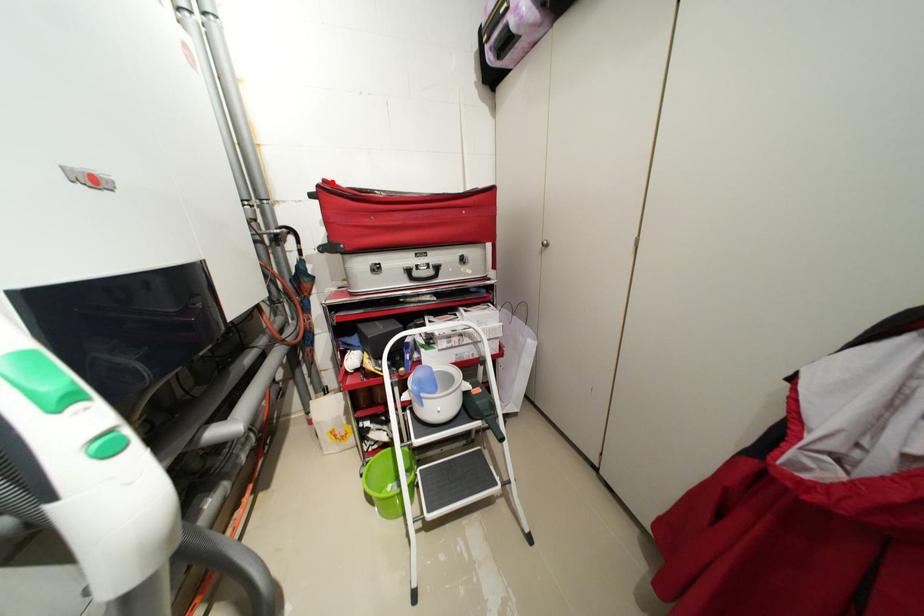
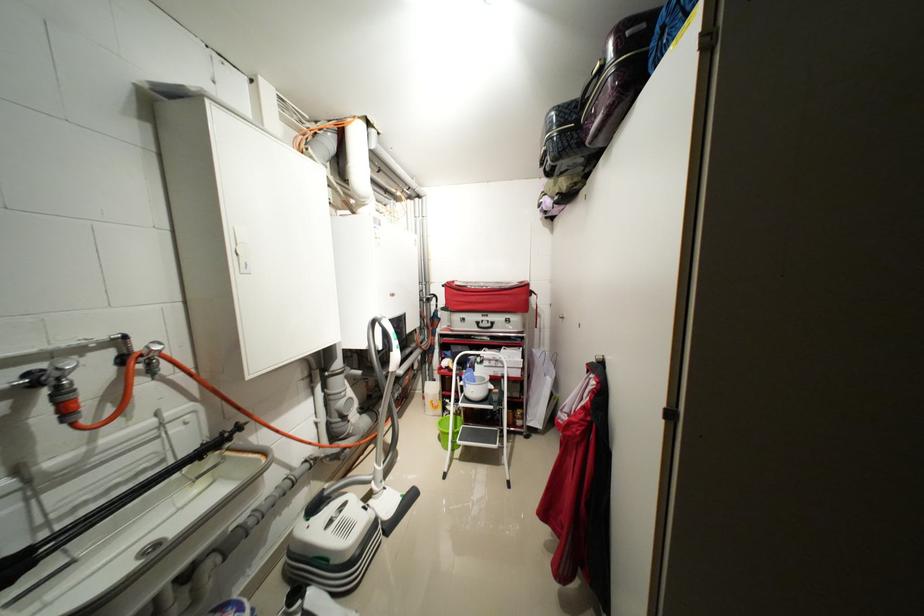
Find the pixel in the second image that matches the highlighted location in the first image.

(455, 284)